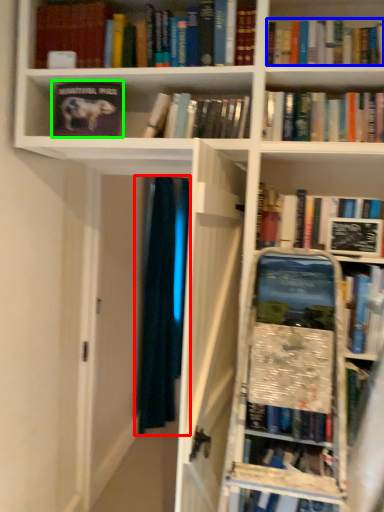
Question: Considering the real-world distances, which object is closest to curtain (highlighted by a red box)? book (highlighted by a blue box) or book (highlighted by a green box).

Choices:
 (A) book
 (B) book

Answer: (B)